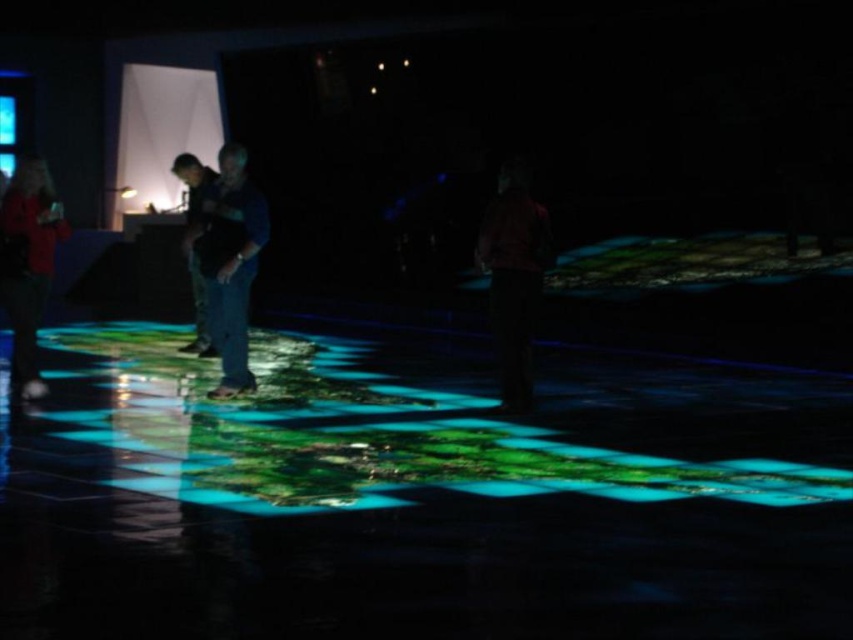
Between point (512, 369) and point (38, 275), which one is positioned behind?

Positioned behind is point (38, 275).

Who is shorter, dark red shirt at center or matte red shirt at left?

With less height is matte red shirt at left.

Between point (488, 211) and point (27, 301), which one is positioned in front?

Point (488, 211)

The height and width of the screenshot is (640, 853). Find the location of `dark red shirt at center`. dark red shirt at center is located at coordinates (514, 275).

From the picture: Between dark blue jeans at center and matte red shirt at left, which one has more height?

dark blue jeans at center is taller.

Does dark blue jeans at center have a lesser width compared to matte red shirt at left?

No.

Where is `dark blue jeans at center`? dark blue jeans at center is located at coordinates (230, 262).

Is dark blue jeans at center wider than dark red shirt at center?

Yes, dark blue jeans at center is wider than dark red shirt at center.

Who is more distant from viewer, (225, 161) or (523, 305)?

Positioned behind is point (225, 161).

Locate an element on the screen. Image resolution: width=853 pixels, height=640 pixels. dark blue jeans at center is located at coordinates (230, 262).